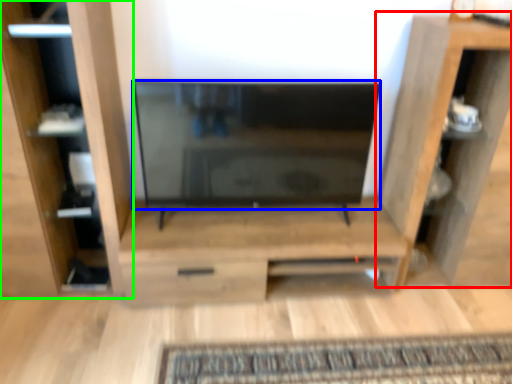
Question: Which is nearer to the shelf (highlighted by a red box)? screen (highlighted by a blue box) or furniture (highlighted by a green box).

Choices:
 (A) screen
 (B) furniture

Answer: (A)